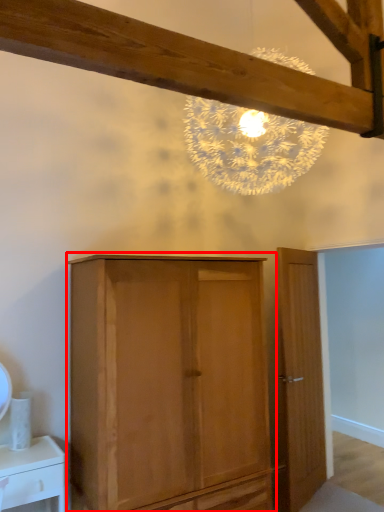
Question: From the image's perspective, what is the correct spatial positioning of cupboard (annotated by the red box) in reference to door?

Choices:
 (A) below
 (B) above

Answer: (A)